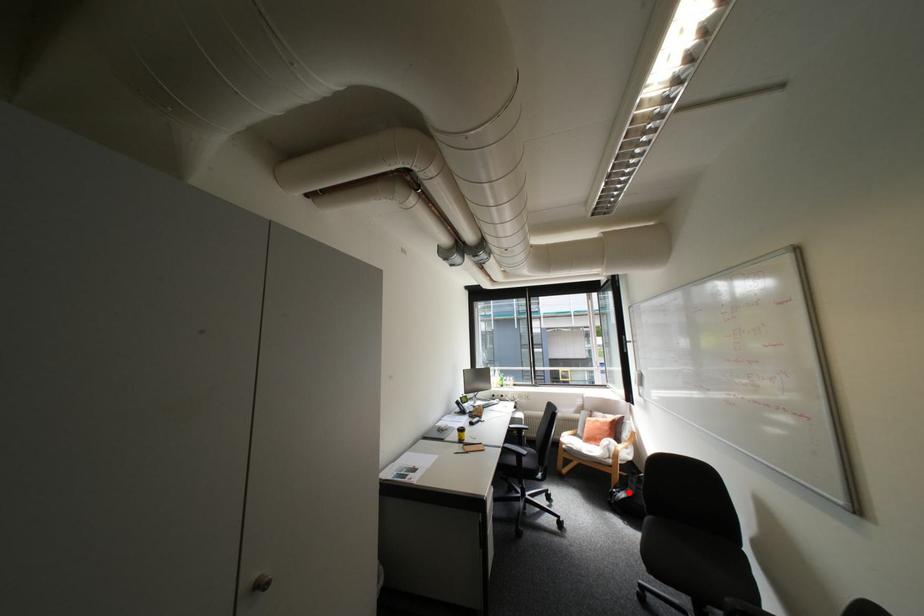
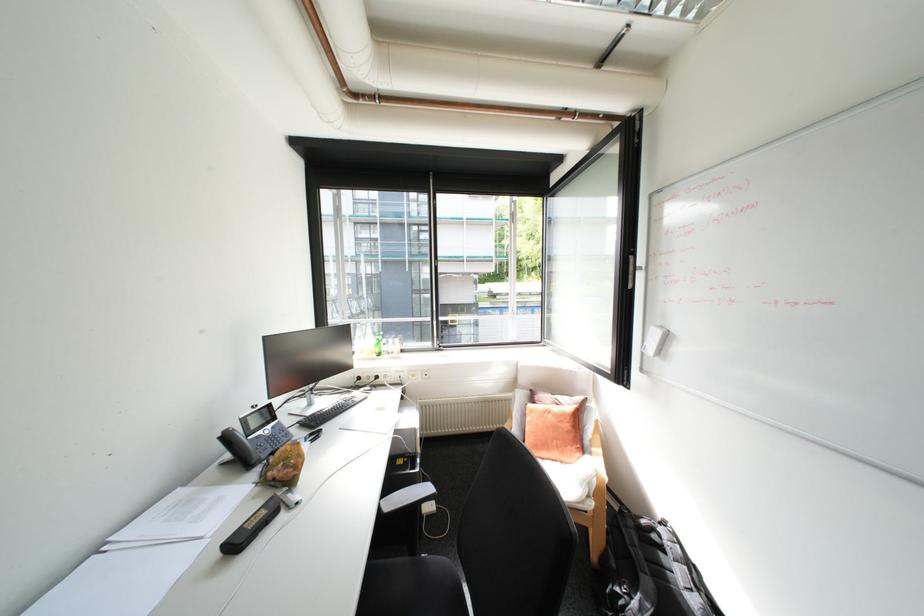
The point at the highlighted location is marked in the first image. Where is the corresponding point in the second image?

(640, 598)